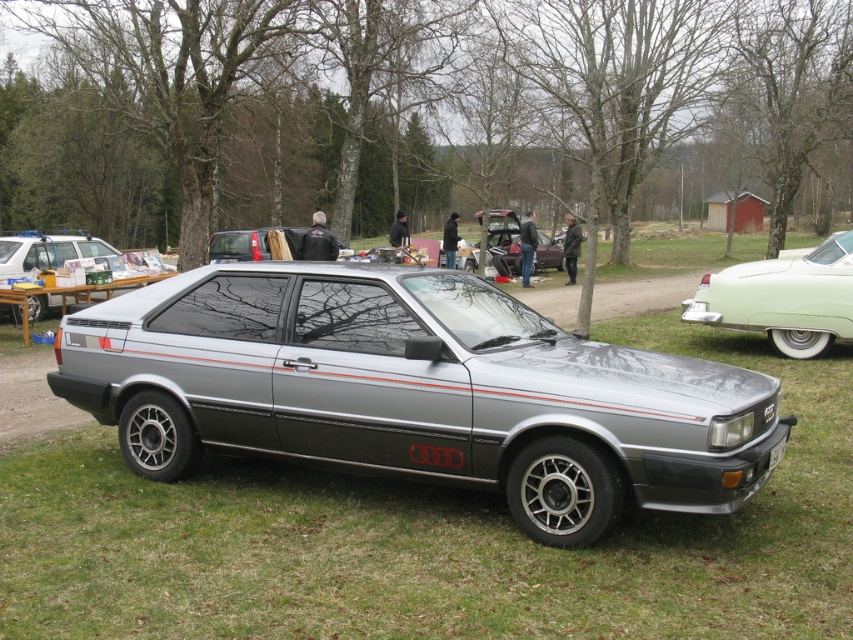
Who is positioned more to the right, metallic silver car at center or white plastic license plate at front?

Positioned to the right is metallic silver car at center.

Is point (494, 232) closer to viewer compared to point (778, 458)?

No, it is behind (778, 458).

I want to click on metallic silver car at center, so click(x=503, y=241).

Can you confirm if satin metallic car at center is shorter than white plastic license plate at front?

In fact, satin metallic car at center may be taller than white plastic license plate at front.

Who is higher up, satin metallic car at center or white plastic license plate at front?

satin metallic car at center is higher up.

This screenshot has height=640, width=853. What do you see at coordinates (415, 390) in the screenshot? I see `satin metallic car at center` at bounding box center [415, 390].

Image resolution: width=853 pixels, height=640 pixels. I want to click on satin metallic car at center, so click(x=415, y=390).

Based on the photo, can you confirm if satin metallic car at center is smaller than metallic silver car at center?

No, satin metallic car at center is not smaller than metallic silver car at center.

Is satin metallic car at center thinner than metallic silver car at center?

Incorrect, satin metallic car at center's width is not less than metallic silver car at center's.

Where is `satin metallic car at center`? satin metallic car at center is located at coordinates (415, 390).

Locate an element on the screen. This screenshot has width=853, height=640. satin metallic car at center is located at coordinates (415, 390).